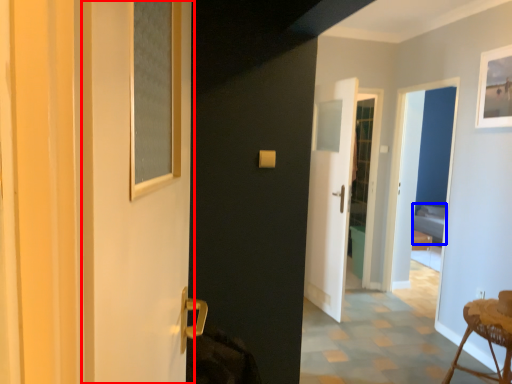
Question: Which object appears farthest to the camera in this image, screen door (highlighted by a red box) or bed (highlighted by a blue box)?

Choices:
 (A) screen door
 (B) bed

Answer: (B)